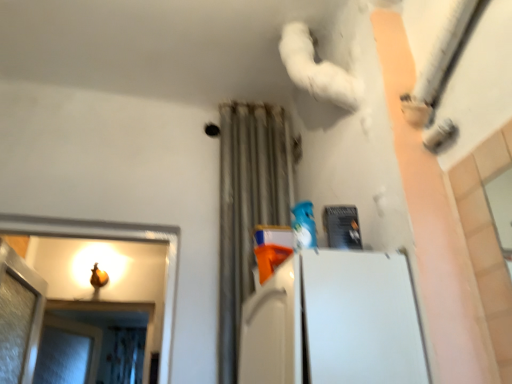
Image resolution: width=512 pixels, height=384 pixels. What do you see at coordinates (334, 322) in the screenshot?
I see `white matte refrigerator at center` at bounding box center [334, 322].

Measure the distance between point (292, 308) and camera.

1.01 meters.

The image size is (512, 384). I want to click on white matte refrigerator at center, so click(334, 322).

I want to click on white matte refrigerator at center, so click(334, 322).